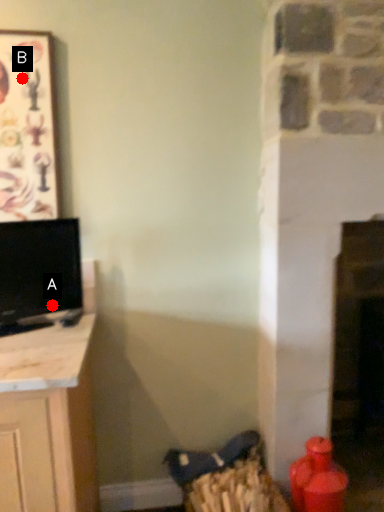
Question: Two points are circled on the image, labeled by A and B beside each circle. Which point appears closest to the camera in this image?

Choices:
 (A) A is closer
 (B) B is closer

Answer: (B)